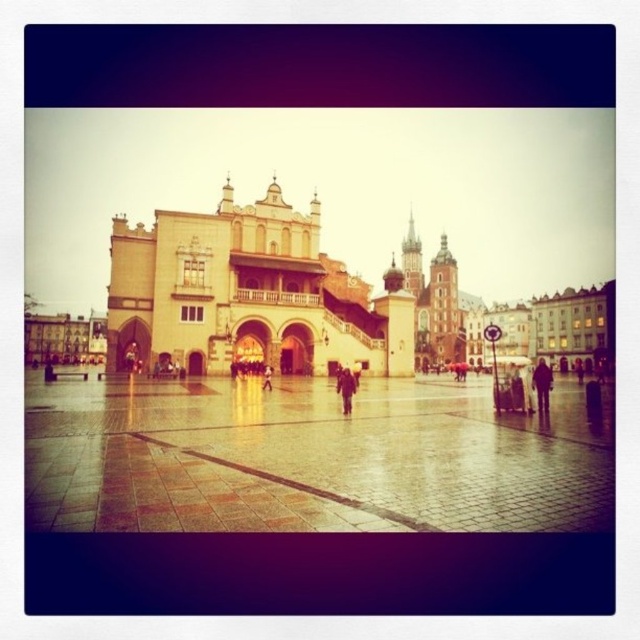
You are standing in the plaza and see the light brown leather jacket at lower right. Where exactly is it located in the image?

The light brown leather jacket at lower right is located at point (541, 385) in the image.